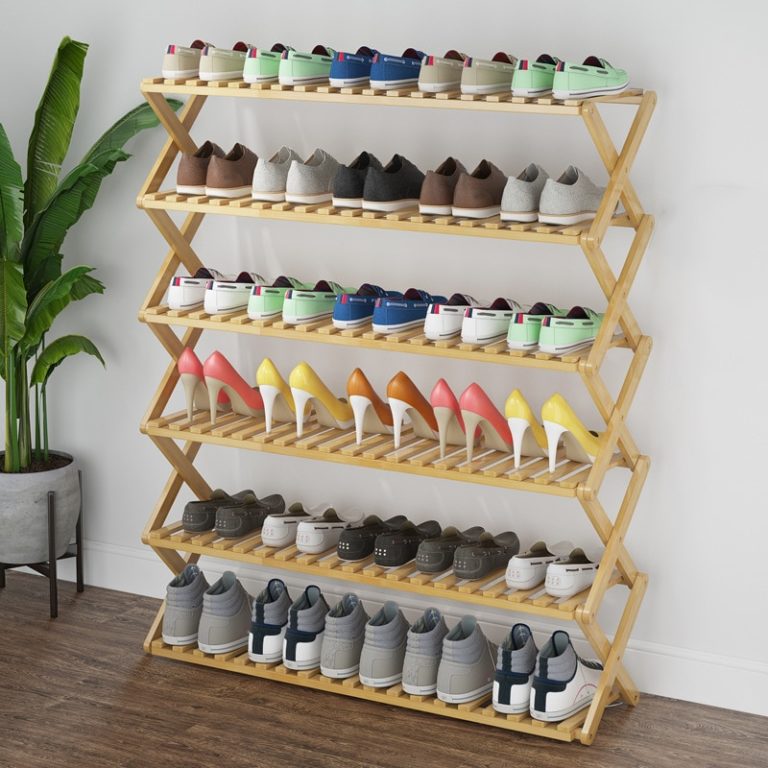
The height and width of the screenshot is (768, 768). Identify the location of shoes on the 2nd shelf from the top. (189, 177), (213, 174), (266, 174), (316, 174), (338, 186), (379, 194), (429, 194), (458, 194), (520, 197), (554, 200).